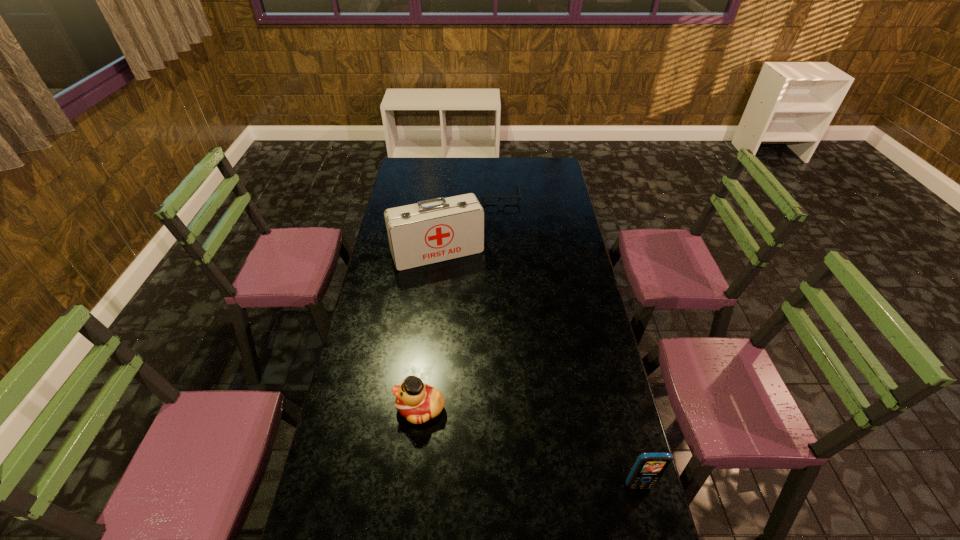
Identify the location of vacant position located 0.130m on the face of the second nearest object. The height and width of the screenshot is (540, 960). (355, 408).

Find the location of a particular element. vacant space located on the screen of the cellular telephone is located at coordinates (645, 510).

I want to click on blank area located 0.180m on the front-facing side of the first-aid kit, so click(x=465, y=300).

At what (x,y) coordinates should I click in order to perform the action: click on vacant space located 0.070m on the front-facing side of the first-aid kit. Please return your answer as a coordinate pair (x, y). This screenshot has width=960, height=540. Looking at the image, I should click on (456, 281).

I want to click on free location located on the front-facing side of the first-aid kit, so click(x=466, y=303).

Where is `blank area located 0.390m on the front-facing side of the shortest object`? The height and width of the screenshot is (540, 960). blank area located 0.390m on the front-facing side of the shortest object is located at coordinates (505, 256).

Where is `vacant point located 0.400m on the front-facing side of the shortest object`? The image size is (960, 540). vacant point located 0.400m on the front-facing side of the shortest object is located at coordinates (505, 258).

This screenshot has width=960, height=540. What are the coordinates of `vacant space located on the front-facing side of the shortest object` in the screenshot? It's located at (504, 242).

Locate an element on the screen. The width and height of the screenshot is (960, 540). object that is at the left edge is located at coordinates (430, 231).

The image size is (960, 540). Identify the location of object that is positioned at the right edge. (649, 467).